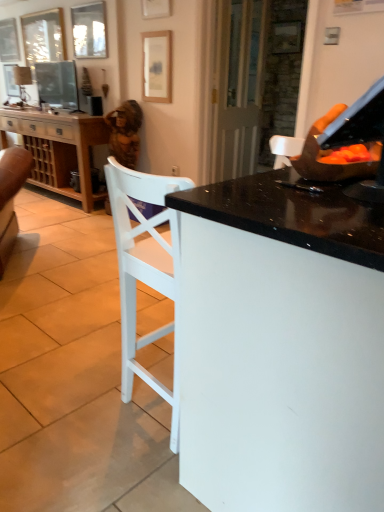
Question: Looking at their shapes, would you say matte wooden picture frame at upper center, the 5th picture frame positioned from the back, is wider or thinner than wooden picture frame at upper left, the 1th picture frame from the left?

Choices:
 (A) thin
 (B) wide

Answer: (B)

Question: From their relative heights in the image, would you say matte wooden picture frame at upper center, marked as the first picture frame in a right-to-left arrangement, is taller or shorter than wooden picture frame at upper left, which appears as the fifth picture frame when viewed from the right?

Choices:
 (A) tall
 (B) short

Answer: (B)

Question: Which object is the closest to the matte wooden picture frame at upper center, marked as the first picture frame in a right-to-left arrangement?

Choices:
 (A) wooden picture frame at upper left, which is the fourth picture frame in right-to-left order
 (B) transparent glass door at center
 (C) matte black television at upper left
 (D) wooden picture frame at upper left, the 5th picture frame positioned from the front
 (E) matte white lampshade at upper left

Answer: (B)

Question: Which object is positioned farthest from the wooden picture frame at upper left, which is counted as the second picture frame, starting from the left?

Choices:
 (A) matte black television at upper left
 (B) wooden picture frame at upper left, the 5th picture frame positioned from the front
 (C) matte white lampshade at upper left
 (D) brown textured statue at upper left
 (E) wooden cabinet at left

Answer: (D)